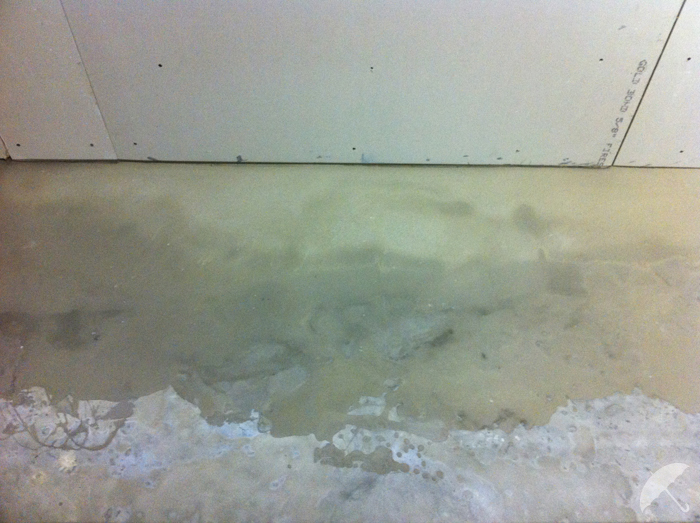
In order to click on floor in this screenshot , I will do `click(461, 302)`.